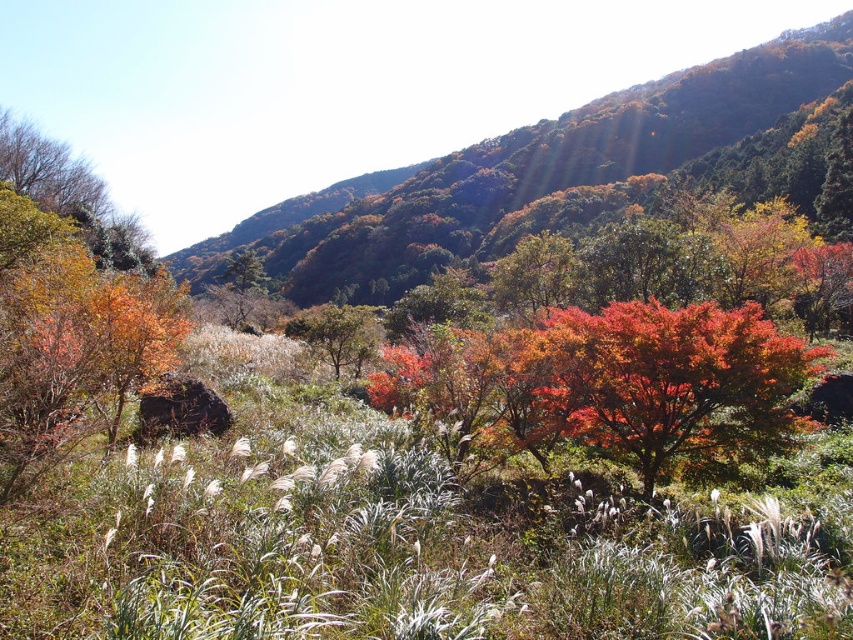
Question: Does autumn foliage at upper center come behind vivid red leaves at center?

Choices:
 (A) yes
 (B) no

Answer: (A)

Question: Which object is positioned farthest from the green matte tree at center?

Choices:
 (A) vivid red leaves at center
 (B) autumn foliage at upper center

Answer: (B)

Question: Can you confirm if autumn foliage at upper center is thinner than green matte tree at center?

Choices:
 (A) yes
 (B) no

Answer: (B)

Question: Which object is the farthest from the vivid red leaves at center?

Choices:
 (A) green matte tree at center
 (B) autumn foliage at upper center

Answer: (B)

Question: Which point is farther from the camera taking this photo?

Choices:
 (A) (541, 349)
 (B) (316, 204)
 (C) (364, 358)

Answer: (B)

Question: Does autumn foliage at upper center have a smaller size compared to vivid red leaves at center?

Choices:
 (A) no
 (B) yes

Answer: (A)